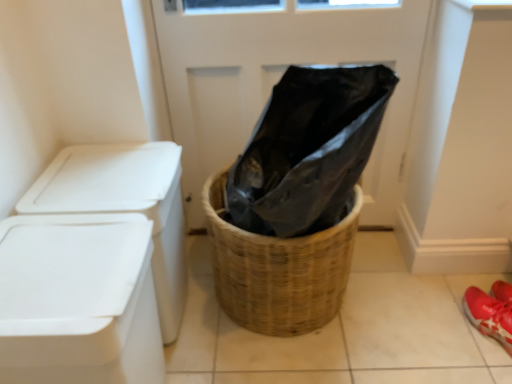
Question: Considering the relative sizes of woven brown basket at center and white plastic container at left in the image provided, is woven brown basket at center bigger than white plastic container at left?

Choices:
 (A) no
 (B) yes

Answer: (B)

Question: From the image's perspective, is woven brown basket at center above white plastic container at left?

Choices:
 (A) yes
 (B) no

Answer: (A)

Question: Is woven brown basket at center touching white plastic container at left?

Choices:
 (A) no
 (B) yes

Answer: (A)

Question: Is woven brown basket at center oriented away from white plastic container at left?

Choices:
 (A) no
 (B) yes

Answer: (A)

Question: Is there a large distance between woven brown basket at center and white plastic container at left?

Choices:
 (A) no
 (B) yes

Answer: (A)

Question: Does point (92, 367) appear closer or farther from the camera than point (236, 119)?

Choices:
 (A) farther
 (B) closer

Answer: (B)

Question: From the image's perspective, is white plastic container at left above or below black plastic bag at center?

Choices:
 (A) below
 (B) above

Answer: (A)

Question: In terms of width, does white plastic container at left look wider or thinner when compared to black plastic bag at center?

Choices:
 (A) wide
 (B) thin

Answer: (A)

Question: Which is correct: white plastic container at left is inside black plastic bag at center, or outside of it?

Choices:
 (A) inside
 (B) outside

Answer: (B)

Question: From the image's perspective, relative to white plastic container at left, is woven brown basket at center above or below?

Choices:
 (A) below
 (B) above

Answer: (B)

Question: Considering the positions of woven brown basket at center and white plastic container at left in the image, is woven brown basket at center wider or thinner than white plastic container at left?

Choices:
 (A) wide
 (B) thin

Answer: (A)

Question: Considering the positions of woven brown basket at center and white plastic container at left in the image, is woven brown basket at center taller or shorter than white plastic container at left?

Choices:
 (A) short
 (B) tall

Answer: (A)

Question: Considering the positions of point (336, 306) and point (104, 269), is point (336, 306) closer or farther from the camera than point (104, 269)?

Choices:
 (A) farther
 (B) closer

Answer: (A)

Question: Is white plastic container at left taller or shorter than woven brown basket at center?

Choices:
 (A) tall
 (B) short

Answer: (A)

Question: In the image, is white plastic container at left positioned in front of or behind woven brown basket at center?

Choices:
 (A) behind
 (B) front

Answer: (B)